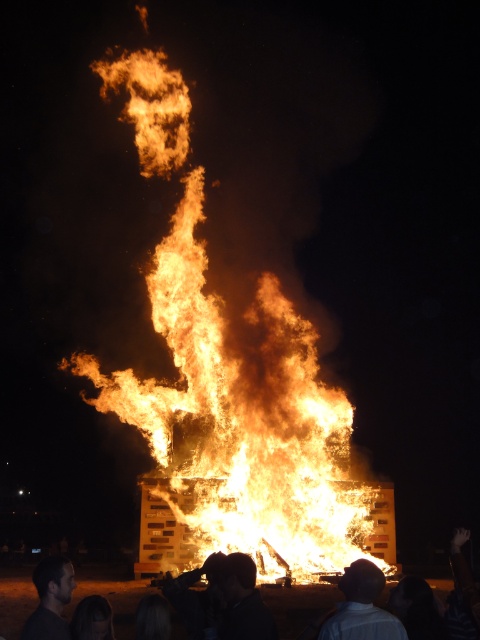
This screenshot has height=640, width=480. What do you see at coordinates (242, 600) in the screenshot?
I see `dark hair at lower center` at bounding box center [242, 600].

Which is behind, point (229, 566) or point (46, 618)?

Point (229, 566)

Does point (228, 564) come behind point (57, 637)?

Yes.

Identify the location of dark hair at lower center. (242, 600).

Is flaming wood at center above dark hair at lower center?

Indeed, flaming wood at center is positioned over dark hair at lower center.

Who is shorter, flaming wood at center or dark hair at lower center?

dark hair at lower center

The width and height of the screenshot is (480, 640). Identify the location of flaming wood at center. pos(240,422).

Locate an element on the screen. This screenshot has width=480, height=640. flaming wood at center is located at coordinates click(x=240, y=422).

Who is more distant from viewer, [348,582] or [245,621]?

The point [348,582] is more distant.

Which of these two, white cotton shirt at lower center or dark hair at lower center, stands taller?

With more height is dark hair at lower center.

Is point (348, 588) positioned after point (230, 609)?

Yes.

What are the coordinates of `white cotton shirt at lower center` in the screenshot? It's located at (361, 608).